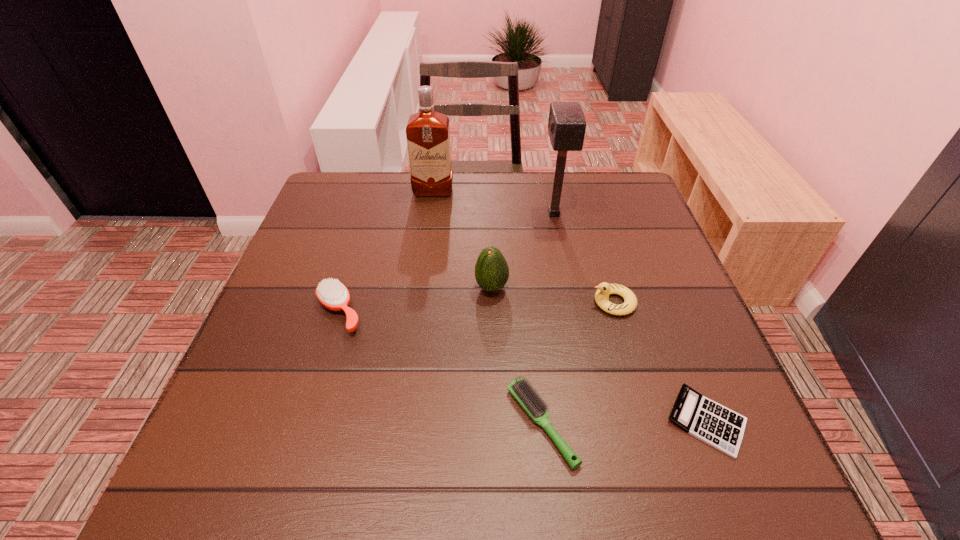
Locate an element on the screen. This screenshot has width=960, height=540. liquor is located at coordinates (428, 133).

The width and height of the screenshot is (960, 540). What are the coordinates of `the farthest object` in the screenshot? It's located at (428, 133).

The image size is (960, 540). In order to click on the sixth nearest object in this screenshot , I will do `click(566, 126)`.

I want to click on mallet, so click(x=566, y=126).

Find the location of a particular element. The width and height of the screenshot is (960, 540). avocado is located at coordinates (491, 270).

Locate an element on the screen. The width and height of the screenshot is (960, 540). the fourth tallest object is located at coordinates (604, 289).

The image size is (960, 540). Identify the location of the third shortest object. (332, 294).

Where is `the left hairbrush`? the left hairbrush is located at coordinates (332, 294).

The image size is (960, 540). Identify the location of the sixth tallest object. (533, 405).

You are a GUI agent. You are given a task and a screenshot of the screen. Output one action in this format:
    pyautogui.click(x=<x>, y=<y>)
    Task: Click on the right hairbrush
    
    Given the screenshot: What is the action you would take?
    pyautogui.click(x=533, y=405)